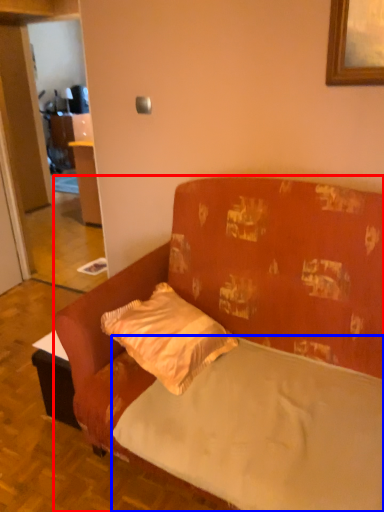
Question: Among these objects, which one is nearest to the camera, studio couch (highlighted by a red box) or mattress (highlighted by a blue box)?

Choices:
 (A) studio couch
 (B) mattress

Answer: (A)